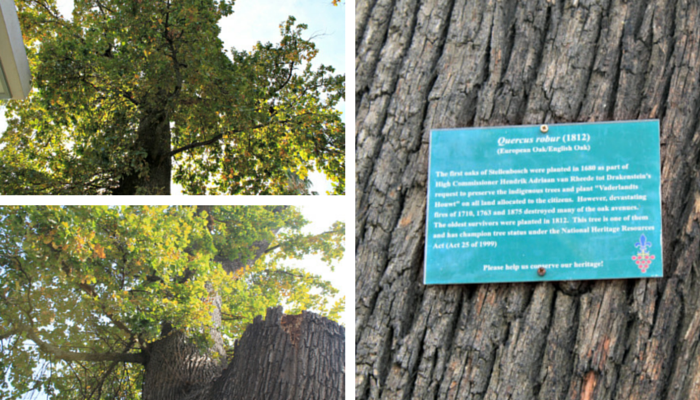
The image size is (700, 400). In order to click on screws in this screenshot , I will do `click(545, 127)`, `click(540, 269)`.